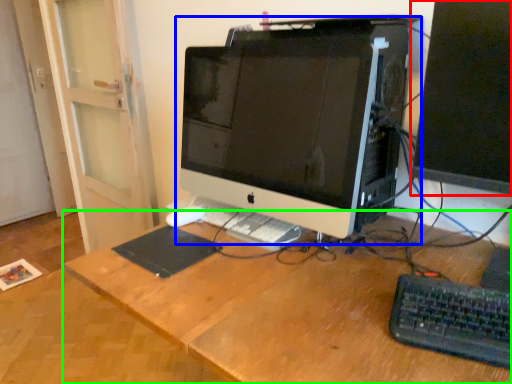
Question: Which object is the farthest from computer monitor (highlighted by a red box)? Choose among these: computer monitor (highlighted by a blue box) or desk (highlighted by a green box).

Choices:
 (A) computer monitor
 (B) desk

Answer: (B)